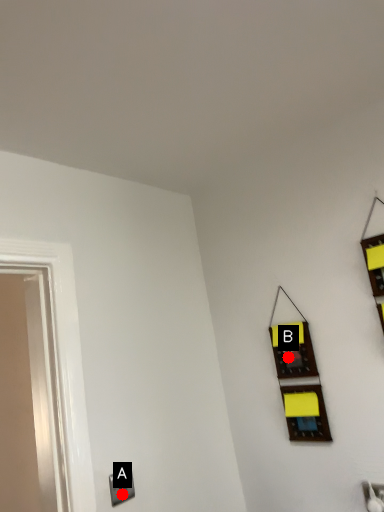
Question: Two points are circled on the image, labeled by A and B beside each circle. Which point is closer to the camera?

Choices:
 (A) A is closer
 (B) B is closer

Answer: (A)